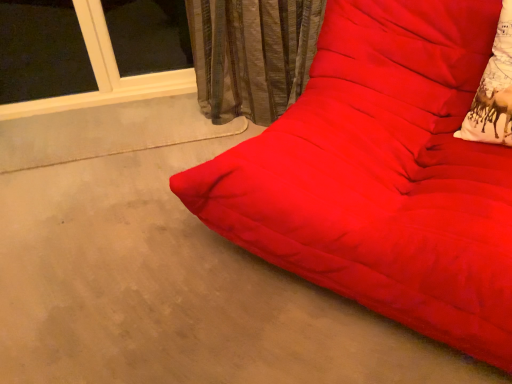
Question: Is matte red futon at center closer to camera compared to white printed fabric at right?

Choices:
 (A) no
 (B) yes

Answer: (B)

Question: Can you confirm if matte red futon at center is taller than white printed fabric at right?

Choices:
 (A) yes
 (B) no

Answer: (A)

Question: Is matte red futon at center shorter than white printed fabric at right?

Choices:
 (A) yes
 (B) no

Answer: (B)

Question: From the image's perspective, is matte red futon at center located above white printed fabric at right?

Choices:
 (A) yes
 (B) no

Answer: (B)

Question: Is matte red futon at center placed right next to white printed fabric at right?

Choices:
 (A) yes
 (B) no

Answer: (B)

Question: Is matte red futon at center completely or partially outside of white printed fabric at right?

Choices:
 (A) no
 (B) yes

Answer: (B)

Question: Would you say white printed fabric at right is a long distance from matte red futon at center?

Choices:
 (A) yes
 (B) no

Answer: (B)

Question: Would you say white printed fabric at right is outside matte red futon at center?

Choices:
 (A) no
 (B) yes

Answer: (A)

Question: From the image's perspective, would you say white printed fabric at right is positioned over matte red futon at center?

Choices:
 (A) no
 (B) yes

Answer: (B)

Question: Is white printed fabric at right thinner than matte red futon at center?

Choices:
 (A) no
 (B) yes

Answer: (B)

Question: Can you confirm if white printed fabric at right is taller than matte red futon at center?

Choices:
 (A) yes
 (B) no

Answer: (B)

Question: From the image's perspective, is white printed fabric at right beneath matte red futon at center?

Choices:
 (A) no
 (B) yes

Answer: (A)

Question: Is white printed fabric at right situated inside matte red futon at center or outside?

Choices:
 (A) outside
 (B) inside

Answer: (B)